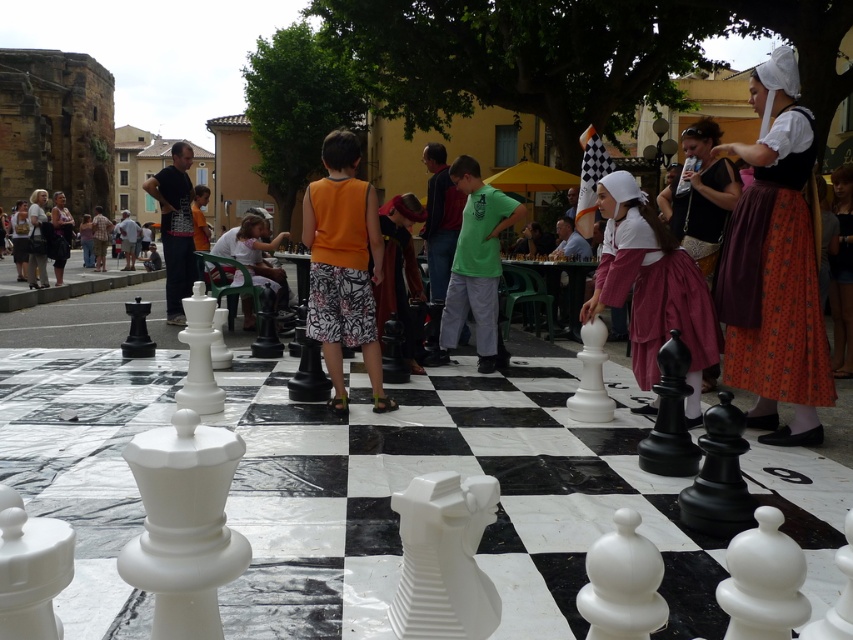
Question: Is white matte chess piece at center closer to camera compared to white plastic chair at center?

Choices:
 (A) yes
 (B) no

Answer: (A)

Question: Which point appears farthest from the camera in this image?

Choices:
 (A) (757, 272)
 (B) (630, 337)
 (C) (354, 138)
 (D) (474, 173)

Answer: (D)

Question: Does white matte chess piece at center appear under matte white shirt at left?

Choices:
 (A) yes
 (B) no

Answer: (A)

Question: Which object is the closest to the white matte chess piece at center?

Choices:
 (A) white plastic chair at center
 (B) orange printed skirt at center
 (C) matte white shirt at left

Answer: (B)

Question: Among these points, which one is nearest to the camera?

Choices:
 (A) (663, 272)
 (B) (451, 294)
 (C) (718, 268)
 (D) (325, 134)

Answer: (C)

Question: Can you confirm if green matte shirt at center is positioned below matte white shirt at left?

Choices:
 (A) no
 (B) yes

Answer: (B)